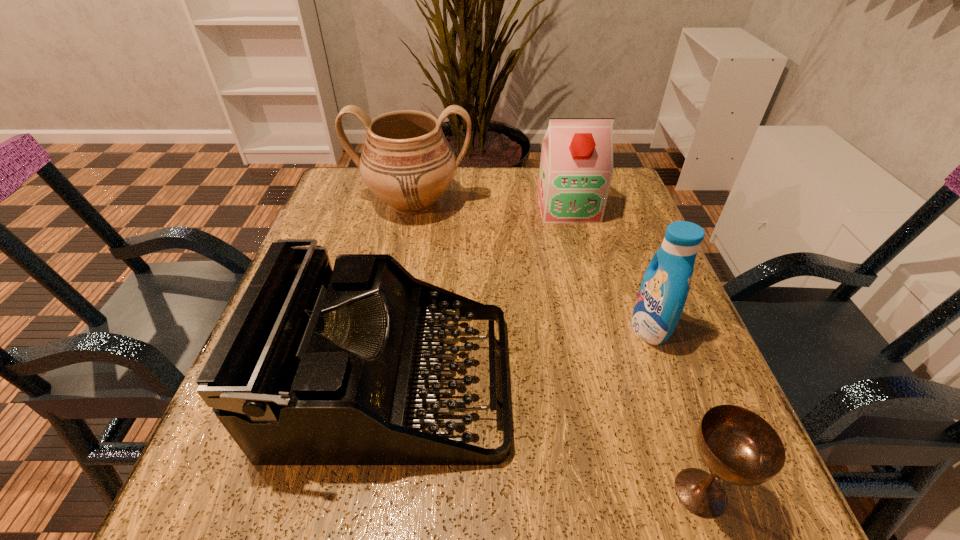
Image resolution: width=960 pixels, height=540 pixels. Identify the location of vacant space located 0.180m on the typing side of the fourth tallest object. pyautogui.click(x=616, y=382).

Find the location of `free space located on the left of the chalice`. free space located on the left of the chalice is located at coordinates (623, 492).

Find the location of a particular element. The height and width of the screenshot is (540, 960). urn that is at the far edge is located at coordinates (407, 162).

Where is `soya milk that is at the far edge`? The height and width of the screenshot is (540, 960). soya milk that is at the far edge is located at coordinates (576, 167).

The height and width of the screenshot is (540, 960). What are the coordinates of `typewriter located in the near edge section of the desktop` in the screenshot? It's located at (316, 366).

This screenshot has width=960, height=540. What are the coordinates of `chalice present at the near edge` in the screenshot? It's located at (737, 445).

This screenshot has height=540, width=960. In order to click on urn located at the left edge in this screenshot , I will do `click(407, 162)`.

I want to click on typewriter that is at the left edge, so click(316, 366).

This screenshot has width=960, height=540. In order to click on soya milk that is at the right edge in this screenshot , I will do `click(576, 167)`.

Identify the location of detergent that is at the right edge. (662, 295).